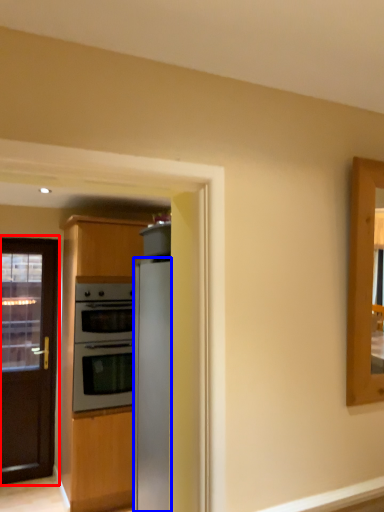
Question: Which object is closer to the camera taking this photo, door (highlighted by a red box) or refrigerator (highlighted by a blue box)?

Choices:
 (A) door
 (B) refrigerator

Answer: (B)